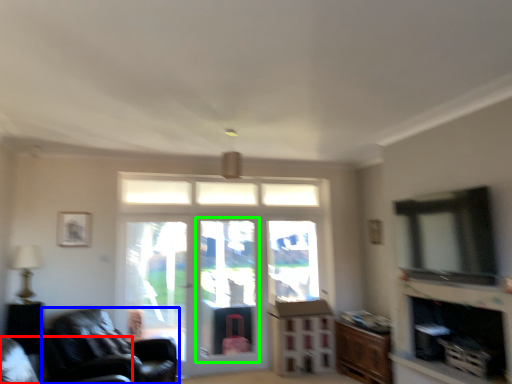
Question: Estimate the real-world distances between objects in this image. Which object is farther from chair (highlighted by a red box), chair (highlighted by a blue box) or screen door (highlighted by a green box)?

Choices:
 (A) chair
 (B) screen door

Answer: (B)